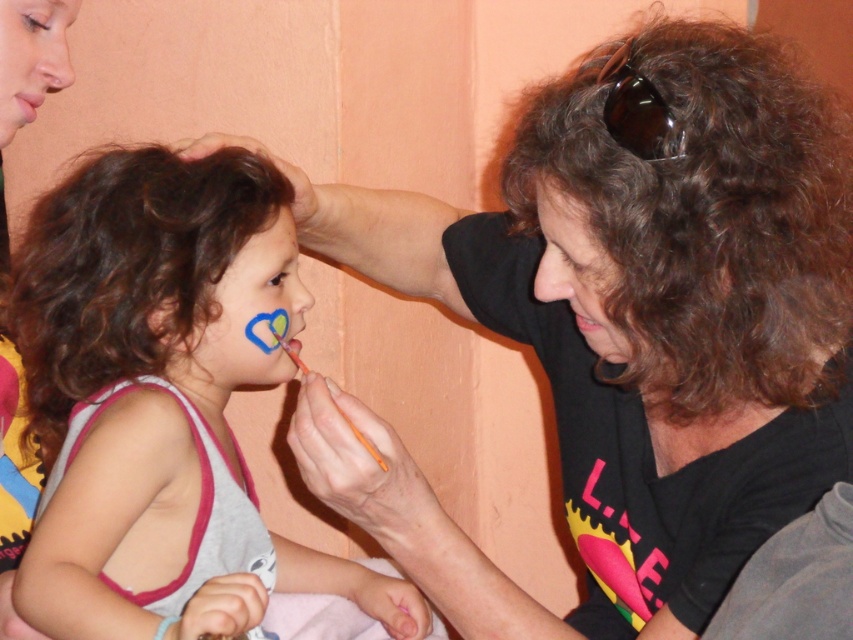
How much distance is there between pink matte nose at upper left and matte pink lips at center?

pink matte nose at upper left is 0.64 inches from matte pink lips at center.

Who is more distant from viewer, (x=32, y=16) or (x=25, y=108)?

Point (x=25, y=108)

The height and width of the screenshot is (640, 853). Identify the location of pink matte nose at upper left. (49, 52).

Identify the location of pink matte nose at upper left. The width and height of the screenshot is (853, 640). (49, 52).

Which of these two, smooth skin at upper left or matte skin nose at upper right, stands taller?

smooth skin at upper left

Is point (9, 92) positioned before point (544, 268)?

No, (9, 92) is further to viewer.

The width and height of the screenshot is (853, 640). Find the location of `smooth skin at upper left`. smooth skin at upper left is located at coordinates (32, 58).

Looking at this image, can you confirm if pink matte nose at upper left is bigger than matte blue nose at center?

Indeed, pink matte nose at upper left has a larger size compared to matte blue nose at center.

Can you confirm if pink matte nose at upper left is taller than matte blue nose at center?

Indeed, pink matte nose at upper left has a greater height compared to matte blue nose at center.

Is point (38, 93) closer to camera compared to point (297, 285)?

Yes.

Where is `pink matte nose at upper left`? This screenshot has width=853, height=640. pink matte nose at upper left is located at coordinates (49, 52).